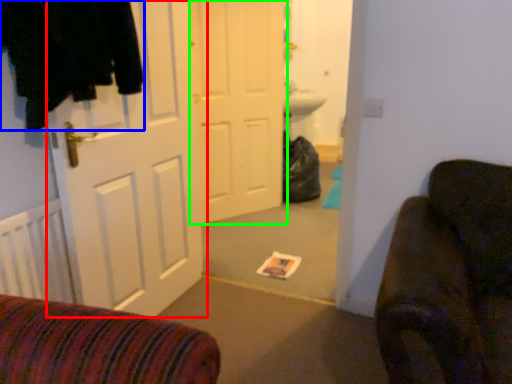
Question: Which object is the farthest from door (highlighted by a red box)? Choose among these: clothing (highlighted by a blue box) or door (highlighted by a green box).

Choices:
 (A) clothing
 (B) door

Answer: (B)